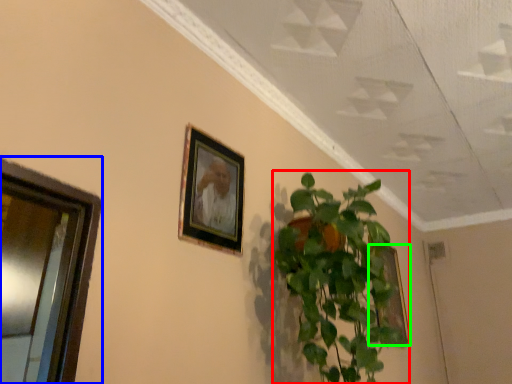
Question: Based on their relative distances, which object is nearer to houseplant (highlighted by a red box)? Choose from window (highlighted by a blue box) and picture frame (highlighted by a green box).

Choices:
 (A) window
 (B) picture frame

Answer: (A)